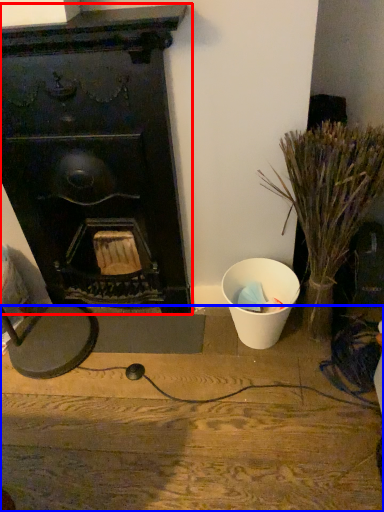
Question: Among these objects, which one is nearest to the camera, fireplace (highlighted by a red box) or furniture (highlighted by a blue box)?

Choices:
 (A) fireplace
 (B) furniture

Answer: (A)